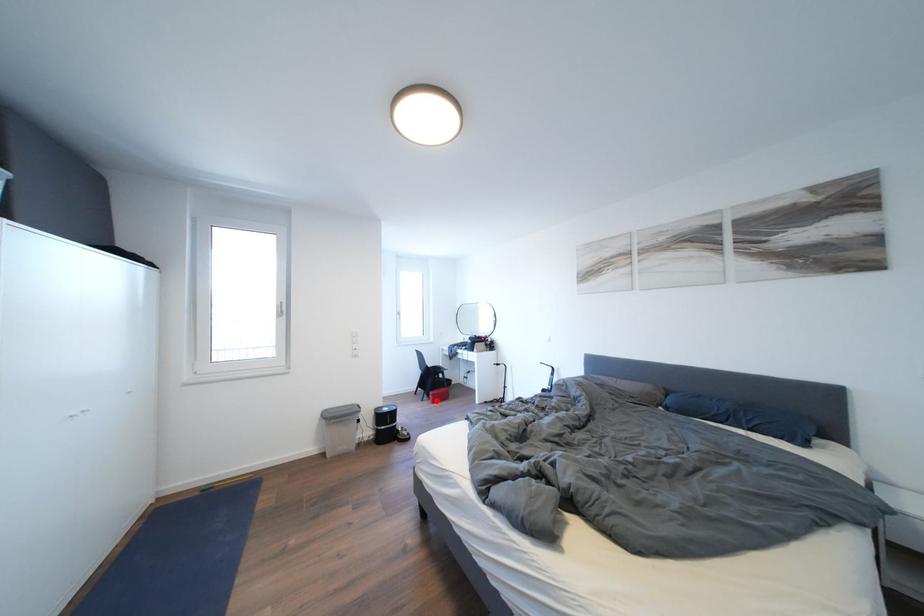
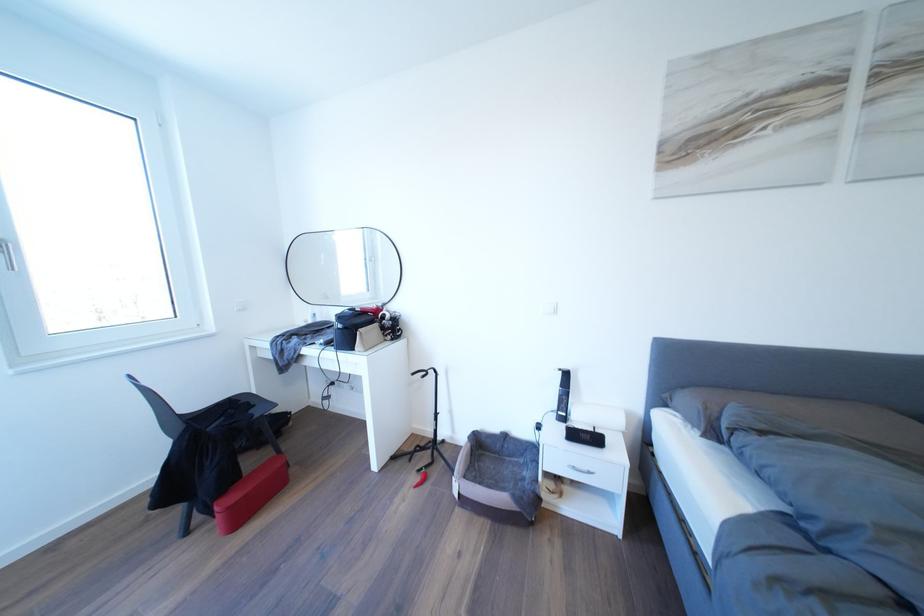
Question: I am providing you with two images of the same scene from different viewpoints. Given a red point in image1, look at the same physical point in image2. Is it:

Choices:
 (A) Closer to the viewpoint
 (B) Farther from the viewpoint

Answer: (A)